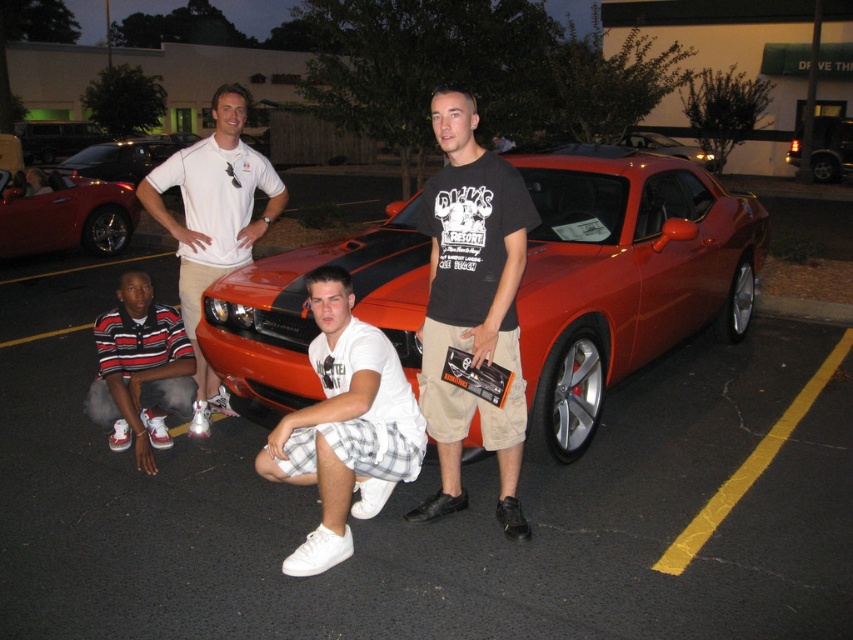
Between black cotton t-shirt at center and white cotton polo shirt at upper center, which one has less height?

Standing shorter between the two is black cotton t-shirt at center.

Which is more to the left, black cotton t-shirt at center or white cotton polo shirt at upper center?

Positioned to the left is white cotton polo shirt at upper center.

Find the location of a particular element. black cotton t-shirt at center is located at coordinates (473, 304).

Does white plaid shorts at center have a lesser width compared to striped cotton shirt at lower left?

No, white plaid shorts at center is not thinner than striped cotton shirt at lower left.

Does white plaid shorts at center appear under striped cotton shirt at lower left?

Indeed, white plaid shorts at center is positioned under striped cotton shirt at lower left.

Locate an element on the screen. The width and height of the screenshot is (853, 640). white plaid shorts at center is located at coordinates (345, 426).

Is point (218, 289) in front of point (80, 161)?

Yes, it is in front of point (80, 161).

Where is `shiny metallic car at center`? Image resolution: width=853 pixels, height=640 pixels. shiny metallic car at center is located at coordinates (624, 276).

What do you see at coordinates (624, 276) in the screenshot? I see `shiny metallic car at center` at bounding box center [624, 276].

This screenshot has width=853, height=640. I want to click on shiny metallic car at center, so click(x=624, y=276).